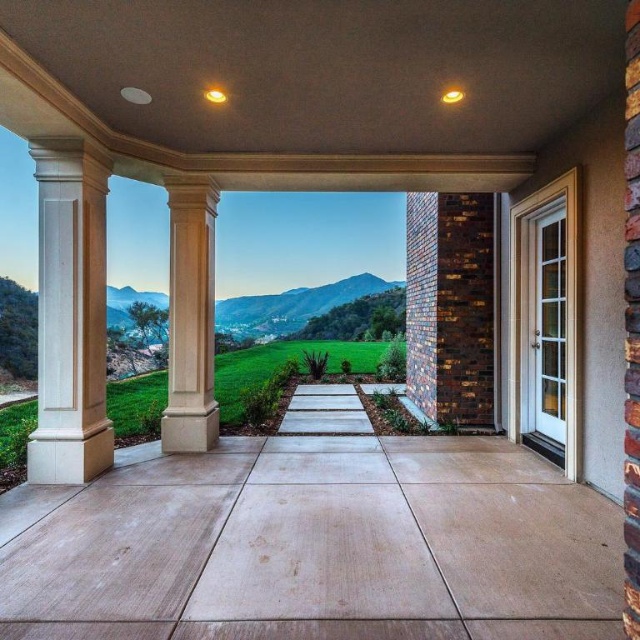
You are standing on the porch and want to place a large potted plant between the beige stone column at center and the green grass at center. Which object should you place it closer to to ensure it doesn not block the view of the smaller one?

You should place the large potted plant closer to the beige stone column at center because it is smaller than the green grass at center, so placing the plant near the smaller column will keep the grass visible.

You are standing on the porch and want to see if the beige stone column at center is taller than the green grass at center. Based on the scene description, can you determine which one is taller?

The beige stone column at center has a lesser height compared to green grass at center, so the green grass at center is taller.

You are standing on the porch and want to know which of the two points, point (211, 468) or point (202, 365), is nearer to you. Based on the scene description, can you determine which one is closer?

Point (211, 468) is closer to the camera than point (202, 365), so it is nearer to you.